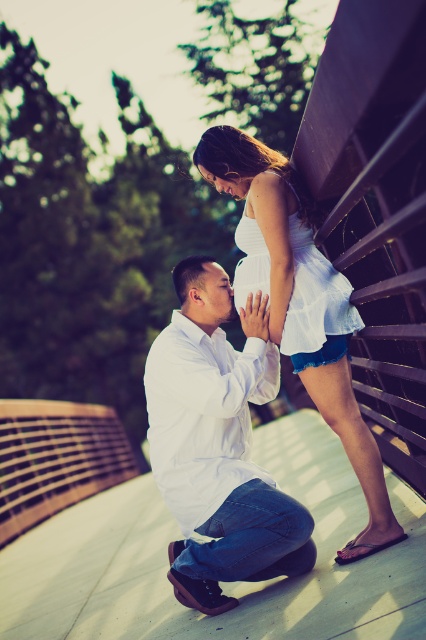
Which is more to the right, white cotton dress at upper center or matte white forehead at upper center?

white cotton dress at upper center is more to the right.

Who is positioned more to the left, white cotton dress at upper center or matte white forehead at upper center?

Positioned to the left is matte white forehead at upper center.

Who is more forward, (226,192) or (219,268)?

Point (219,268) is in front.

At what (x,y) coordinates should I click in order to perform the action: click on white cotton dress at upper center. Please return your answer as a coordinate pair (x, y). Looking at the image, I should click on tap(299, 304).

Can you confirm if matte white belly at center is smaller than matte white forehead at upper center?

Incorrect, matte white belly at center is not smaller in size than matte white forehead at upper center.

Between point (213, 464) and point (218, 269), which one is positioned in front?

Point (213, 464) is in front.

You are a GUI agent. You are given a task and a screenshot of the screen. Output one action in this format:
    pyautogui.click(x=<x>, y=<y>)
    Task: Click on the matte white belly at center
    The width and height of the screenshot is (426, 640).
    Given the screenshot: What is the action you would take?
    pyautogui.click(x=201, y=484)

Which is above, white cotton shirt at lower center or white cotton dress at center?

Positioned higher is white cotton dress at center.

Can you confirm if white cotton shirt at lower center is wider than white cotton dress at center?

Yes, white cotton shirt at lower center is wider than white cotton dress at center.

Who is more forward, (181, 356) or (244, 260)?

Point (181, 356) is in front.

Find the location of a particular element. The width and height of the screenshot is (426, 640). white cotton shirt at lower center is located at coordinates (218, 445).